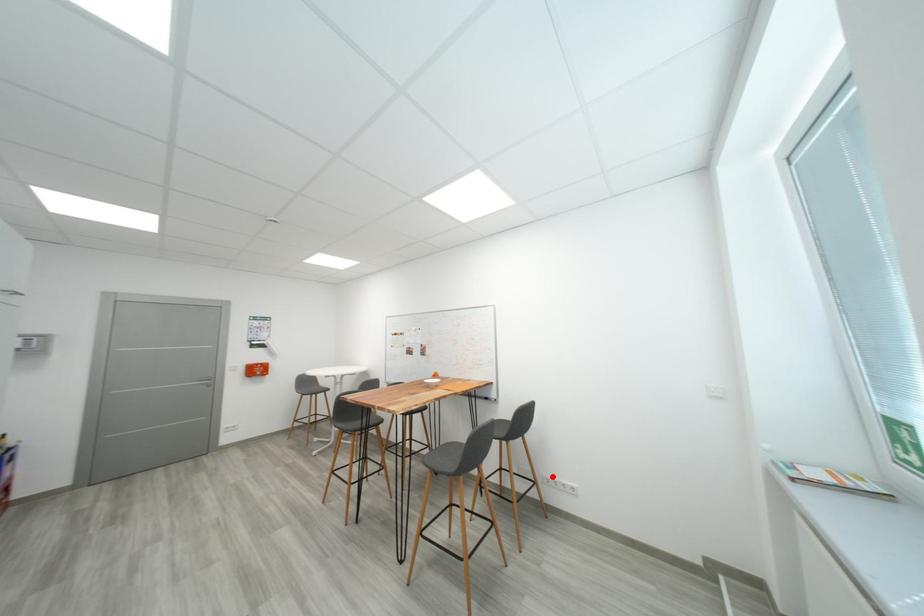
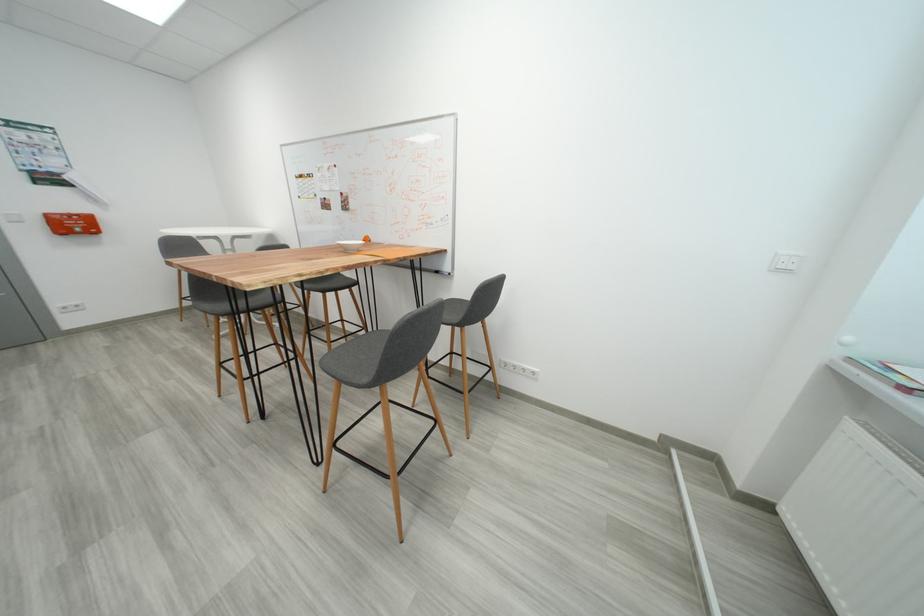
Where in the second image is the point corresponding to the highlighted location from the first image?

(511, 361)